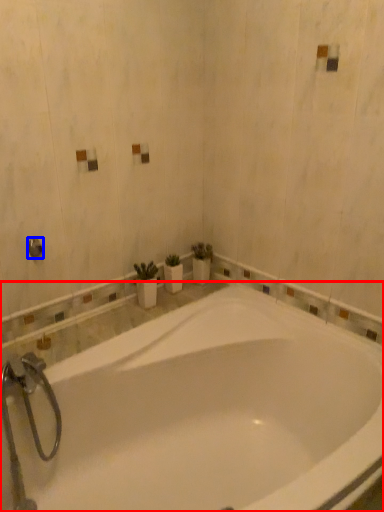
Question: Which object is further to the camera taking this photo, bathtub (highlighted by a red box) or shower (highlighted by a blue box)?

Choices:
 (A) bathtub
 (B) shower

Answer: (B)